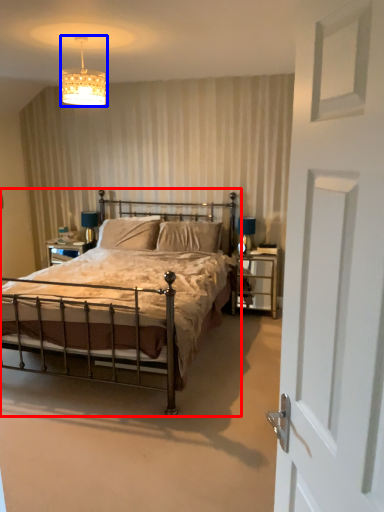
Question: Among these objects, which one is nearest to the camera, bed (highlighted by a red box) or lighting (highlighted by a blue box)?

Choices:
 (A) bed
 (B) lighting

Answer: (A)